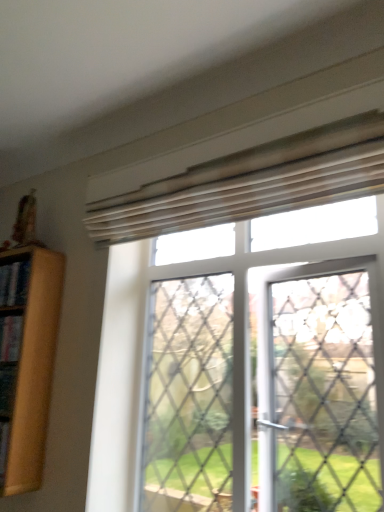
This screenshot has height=512, width=384. What do you see at coordinates (206, 379) in the screenshot?
I see `translucent wood blinds at upper center` at bounding box center [206, 379].

The width and height of the screenshot is (384, 512). I want to click on translucent wood blinds at upper center, so click(x=206, y=379).

From the picture: What is the approximate height of wooden bookshelf at left?

1.01 meters.

Locate an element on the screen. The image size is (384, 512). wooden bookshelf at left is located at coordinates (30, 364).

The height and width of the screenshot is (512, 384). Describe the element at coordinates (30, 364) in the screenshot. I see `wooden bookshelf at left` at that location.

At what (x,y) coordinates should I click in order to perform the action: click on translucent wood blinds at upper center. Please return your answer as a coordinate pair (x, y). Looking at the image, I should click on (206, 379).

Can you confirm if wooden bookshelf at left is positioned to the right of translucent wood blinds at upper center?

In fact, wooden bookshelf at left is to the left of translucent wood blinds at upper center.

Is wooden bookshelf at left in front of translucent wood blinds at upper center?

No, the depth of wooden bookshelf at left is greater than that of translucent wood blinds at upper center.

Considering the positions of point (14, 475) and point (237, 413), is point (14, 475) closer or farther from the camera than point (237, 413)?

Clearly, point (14, 475) is more distant from the camera than point (237, 413).

Looking at this image, from the image's perspective, would you say wooden bookshelf at left is shown under translucent wood blinds at upper center?

Yes, from the image's perspective, wooden bookshelf at left is below translucent wood blinds at upper center.

From a real-world perspective, which is physically below, wooden bookshelf at left or translucent wood blinds at upper center?

From a 3D spatial view, wooden bookshelf at left is below.

Based on the photo, which object is wider, wooden bookshelf at left or translucent wood blinds at upper center?

translucent wood blinds at upper center is wider.

From their relative heights in the image, would you say wooden bookshelf at left is taller or shorter than translucent wood blinds at upper center?

wooden bookshelf at left is shorter than translucent wood blinds at upper center.

Looking at the image, does wooden bookshelf at left seem bigger or smaller compared to translucent wood blinds at upper center?

Clearly, wooden bookshelf at left is smaller in size than translucent wood blinds at upper center.

Choose the correct answer: Is wooden bookshelf at left inside translucent wood blinds at upper center or outside it?

wooden bookshelf at left is outside translucent wood blinds at upper center.

Is the surface of wooden bookshelf at left in direct contact with translucent wood blinds at upper center?

No, wooden bookshelf at left is not in contact with translucent wood blinds at upper center.

Is translucent wood blinds at upper center at the back of wooden bookshelf at left?

No, wooden bookshelf at left's orientation is not away from translucent wood blinds at upper center.

At what (x,y) coordinates should I click in order to perform the action: click on shelf beneath the translucent wood blinds at upper center (from a real-world perspective). Please return your answer as a coordinate pair (x, y). Looking at the image, I should click on (30, 364).

Is translucent wood blinds at upper center at the left side of wooden bookshelf at left?

Incorrect, translucent wood blinds at upper center is not on the left side of wooden bookshelf at left.

Which is in front, translucent wood blinds at upper center or wooden bookshelf at left?

translucent wood blinds at upper center.

Considering the points (95, 226) and (9, 438), which point is in front, point (95, 226) or point (9, 438)?

The point (9, 438) is closer to the camera.

From the image's perspective, is translucent wood blinds at upper center above wooden bookshelf at left?

Indeed, from the image's perspective, translucent wood blinds at upper center is shown above wooden bookshelf at left.

From a real-world perspective, is translucent wood blinds at upper center on wooden bookshelf at left?

Yes, from a real-world perspective, translucent wood blinds at upper center is over wooden bookshelf at left

Considering the sizes of objects translucent wood blinds at upper center and wooden bookshelf at left in the image provided, who is wider, translucent wood blinds at upper center or wooden bookshelf at left?

translucent wood blinds at upper center is wider.

Is translucent wood blinds at upper center taller or shorter than wooden bookshelf at left?

translucent wood blinds at upper center is taller than wooden bookshelf at left.

Between translucent wood blinds at upper center and wooden bookshelf at left, which one has smaller size?

wooden bookshelf at left.

Is translucent wood blinds at upper center completely or partially outside of wooden bookshelf at left?

That's correct, translucent wood blinds at upper center is outside of wooden bookshelf at left.

Would you say translucent wood blinds at upper center is a long distance from wooden bookshelf at left?

No, translucent wood blinds at upper center is not far away from wooden bookshelf at left.

Does translucent wood blinds at upper center turn towards wooden bookshelf at left?

No, translucent wood blinds at upper center does not turn towards wooden bookshelf at left.

I want to click on shelf below the translucent wood blinds at upper center (from a real-world perspective), so click(x=30, y=364).

I want to click on window in front of the wooden bookshelf at left, so click(206, 379).

The image size is (384, 512). In order to click on window above the wooden bookshelf at left (from the image's perspective) in this screenshot , I will do `click(206, 379)`.